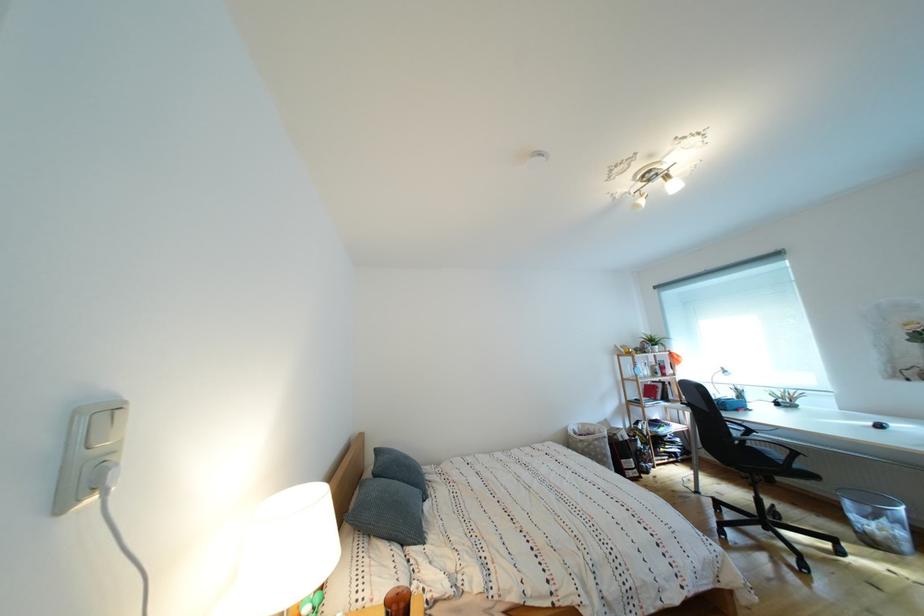
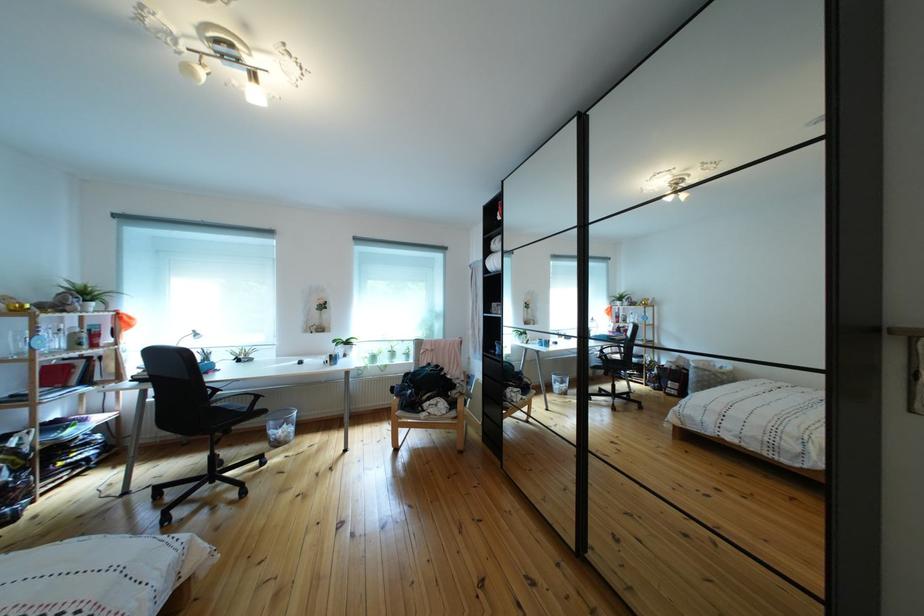
Where in the second image is the point corresponding to [858,509] from the first image?

(283, 430)